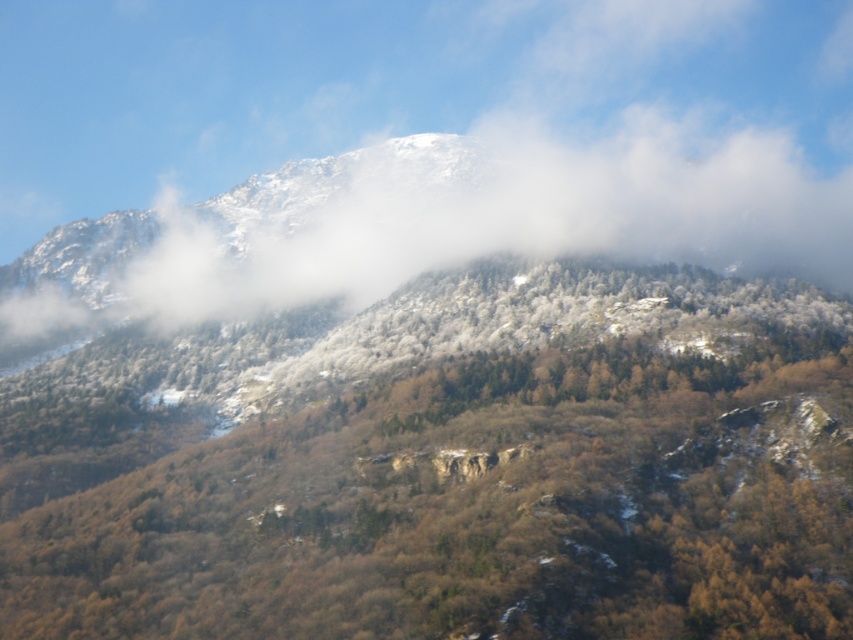
Question: Is green matte tree at center wider than white fluffy cloud at upper center?

Choices:
 (A) yes
 (B) no

Answer: (B)

Question: Which of the following is the closest to the observer?

Choices:
 (A) green matte tree at center
 (B) white fluffy cloud at upper center

Answer: (A)

Question: Does green matte tree at center have a larger size compared to white fluffy cloud at upper center?

Choices:
 (A) no
 (B) yes

Answer: (A)

Question: Can you confirm if green matte tree at center is smaller than white fluffy cloud at upper center?

Choices:
 (A) yes
 (B) no

Answer: (A)